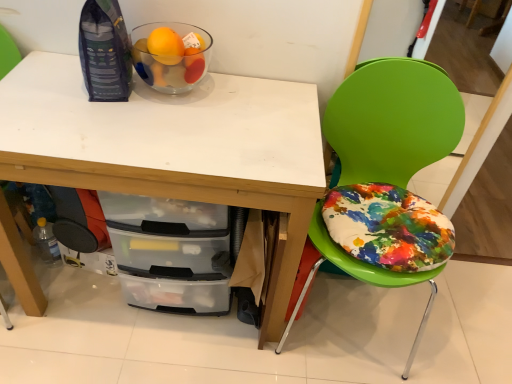
This screenshot has height=384, width=512. What do you see at coordinates (393, 120) in the screenshot?
I see `green plastic chair at right` at bounding box center [393, 120].

The width and height of the screenshot is (512, 384). Find the location of `green plastic chair at right`. green plastic chair at right is located at coordinates (393, 120).

Considering the sizes of white matte desk at upper center and clear plastic bottle at lower left in the image, is white matte desk at upper center wider or thinner than clear plastic bottle at lower left?

Clearly, white matte desk at upper center has more width compared to clear plastic bottle at lower left.

Considering the positions of points (58, 122) and (46, 222), is point (58, 122) farther from camera compared to point (46, 222)?

No, it is not.

From a real-world perspective, who is located lower, white matte desk at upper center or clear plastic bottle at lower left?

From a 3D spatial view, clear plastic bottle at lower left is below.

What's the angular difference between green plastic chair at right and clear plastic bottle at lower left's facing directions?

The angular difference between green plastic chair at right and clear plastic bottle at lower left is 1.98 degrees.

Considering the relative positions of green plastic chair at right and clear plastic bottle at lower left in the image provided, is green plastic chair at right to the left of clear plastic bottle at lower left from the viewer's perspective?

No, green plastic chair at right is not to the left of clear plastic bottle at lower left.

Looking at this image, is green plastic chair at right positioned beyond the bounds of clear plastic bottle at lower left?

That's correct, green plastic chair at right is outside of clear plastic bottle at lower left.

Between point (404, 60) and point (51, 238), which one is positioned in front?

Point (404, 60)

What's the angular difference between clear plastic bottle at lower left and transparent glass bowl at upper left's facing directions?

There is a 3.61-degree angle between the facing directions of clear plastic bottle at lower left and transparent glass bowl at upper left.

Is clear plastic bottle at lower left wider than transparent glass bowl at upper left?

No.

Based on the photo, is the depth of clear plastic bottle at lower left greater than that of transparent glass bowl at upper left?

Yes, clear plastic bottle at lower left is behind transparent glass bowl at upper left.

From the image's perspective, is clear plastic bottle at lower left under transparent glass bowl at upper left?

Yes, from the image's perspective, clear plastic bottle at lower left is below transparent glass bowl at upper left.

From a real-world perspective, is white matte desk at upper center over green plastic chair at right?

No, from a real-world perspective, white matte desk at upper center is not over green plastic chair at right

Considering the positions of objects white matte desk at upper center and green plastic chair at right in the image provided, who is more to the left, white matte desk at upper center or green plastic chair at right?

From the viewer's perspective, white matte desk at upper center appears more on the left side.

Is white matte desk at upper center turned away from green plastic chair at right?

No.

Identify the location of glass bowl positioned vertically above the green plastic chair at right (from a real-world perspective). (170, 55).

Which object is closer to the camera taking this photo, green plastic chair at right or transparent glass bowl at upper left?

green plastic chair at right is closer to the camera.

Is green plastic chair at right oriented away from transparent glass bowl at upper left?

No.

Does point (320, 204) lie in front of point (199, 69)?

No.

Is white matte desk at upper center at the back of transparent glass bowl at upper left?

transparent glass bowl at upper left is not turned away from white matte desk at upper center.

Would you say transparent glass bowl at upper left is outside white matte desk at upper center?

transparent glass bowl at upper left lies outside white matte desk at upper center's area.

Between transparent glass bowl at upper left and white matte desk at upper center, which one is positioned behind?

transparent glass bowl at upper left is further from the camera.

From a real-world perspective, is transparent glass bowl at upper left positioned over white matte desk at upper center based on gravity?

Yes, from a real-world perspective, transparent glass bowl at upper left is on top of white matte desk at upper center.

From the picture: From a real-world perspective, is transparent glass bowl at upper left located beneath clear plastic bottle at lower left?

Actually, transparent glass bowl at upper left is physically above clear plastic bottle at lower left in the real world.

In the scene shown: Can you confirm if transparent glass bowl at upper left is positioned to the right of clear plastic bottle at lower left?

Yes, transparent glass bowl at upper left is to the right of clear plastic bottle at lower left.

Between transparent glass bowl at upper left and clear plastic bottle at lower left, which one has larger width?

Wider between the two is transparent glass bowl at upper left.

Between transparent glass bowl at upper left and clear plastic bottle at lower left, which one has smaller size?

With smaller size is clear plastic bottle at lower left.

Locate an element on the screen. The height and width of the screenshot is (384, 512). desk that is above the clear plastic bottle at lower left (from the image's perspective) is located at coordinates point(172,146).

Identify the location of bottle lying on the left of green plastic chair at right. (46, 242).

When comparing their distances from white matte desk at upper center, does clear plastic bottle at lower left or green plastic chair at right seem closer?

Based on the image, green plastic chair at right appears to be nearer to white matte desk at upper center.

When comparing their distances from clear plastic bottle at lower left, does transparent glass bowl at upper left or green plastic chair at right seem further?

green plastic chair at right is further to clear plastic bottle at lower left.

From the image, which object appears to be farther from transparent glass bowl at upper left, green plastic chair at right or clear plastic bottle at lower left?

clear plastic bottle at lower left.

Based on their spatial positions, is white matte desk at upper center or clear plastic bottle at lower left further from green plastic chair at right?

Based on the image, clear plastic bottle at lower left appears to be further to green plastic chair at right.

From the image, which object appears to be farther from green plastic chair at right, transparent glass bowl at upper left or clear plastic bottle at lower left?

clear plastic bottle at lower left lies further to green plastic chair at right than the other object.

Which object lies further to the anchor point green plastic chair at right, white matte desk at upper center or transparent glass bowl at upper left?

The object further to green plastic chair at right is transparent glass bowl at upper left.

Looking at the image, which one is located closer to clear plastic bottle at lower left, transparent glass bowl at upper left or white matte desk at upper center?

white matte desk at upper center is positioned closer to the anchor clear plastic bottle at lower left.

Looking at the image, which one is located closer to green plastic chair at right, clear plastic bottle at lower left or transparent glass bowl at upper left?

Among the two, transparent glass bowl at upper left is located nearer to green plastic chair at right.

Image resolution: width=512 pixels, height=384 pixels. In order to click on desk situated between clear plastic bottle at lower left and green plastic chair at right from left to right in this screenshot , I will do `click(172, 146)`.

I want to click on glass bowl located between clear plastic bottle at lower left and green plastic chair at right in the left-right direction, so click(x=170, y=55).

Find the location of `glass bowl between white matte desk at upper center and green plastic chair at right`. glass bowl between white matte desk at upper center and green plastic chair at right is located at coordinates (170, 55).

At what (x,y) coordinates should I click in order to perform the action: click on desk between transparent glass bowl at upper left and clear plastic bottle at lower left from top to bottom. Please return your answer as a coordinate pair (x, y). This screenshot has height=384, width=512. Looking at the image, I should click on (172, 146).